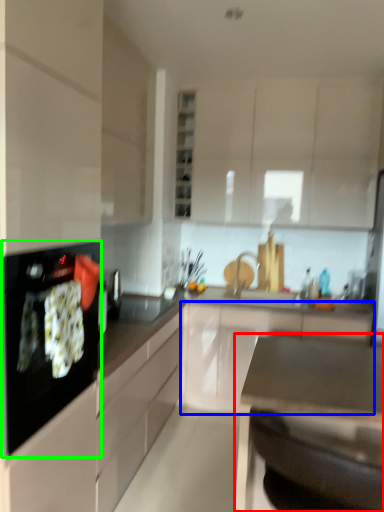
Question: Which object is positioned farthest from countertop (highlighted by a red box)? Select from cabinetry (highlighted by a blue box) and kitchen appliance (highlighted by a green box).

Choices:
 (A) cabinetry
 (B) kitchen appliance

Answer: (A)